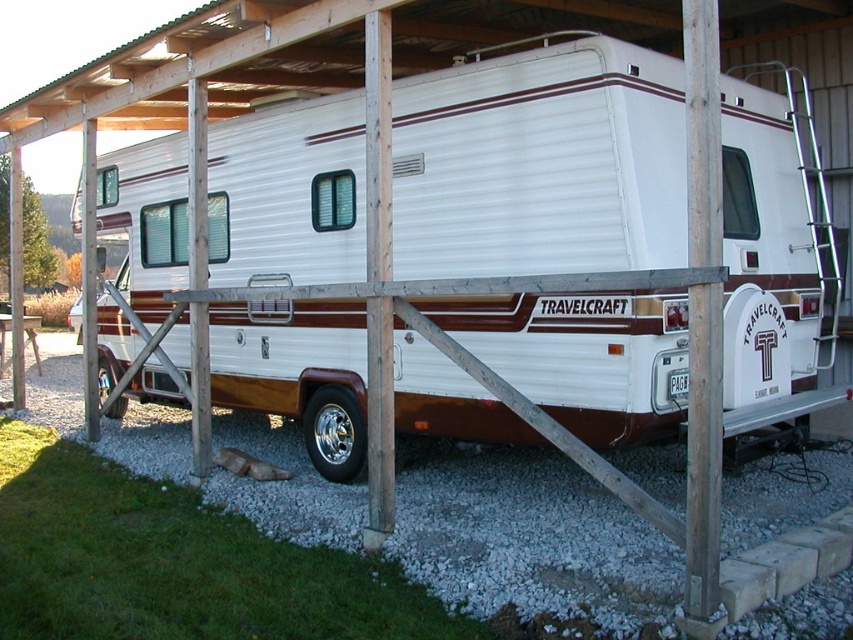
You are planning to park your new car in the area where the white gravel at lower center is located. Considering the space occupied by the white glossy recreational vehicle at center, will there be enough room for your car?

The white glossy recreational vehicle at center occupies less space than the white gravel at lower center, so there should be enough room to park your car in the area with the white gravel at lower center.

You are standing in front of the carport and want to take a photo of the white glossy recreational vehicle at center. If your camera can focus on objects up to 15 feet away, will you need to move closer or farther away to get a clear picture?

The white glossy recreational vehicle at center is 17.59 feet away from the camera, which is beyond the camera focus range of 15 feet. Therefore, you need to move closer to the vehicle to ensure it is within the camera focus range.

From the picture: You are a delivery person with a package that needs to be placed 3 meters away from the white glossy recreational vehicle at center. Can you place the package on the white gravel at lower center?

The distance between the white glossy recreational vehicle at center and the white gravel at lower center is 2.88 meters, so placing the package on the white gravel at lower center would be slightly closer than the required 3 meters. Therefore, it does not meet the requirement.